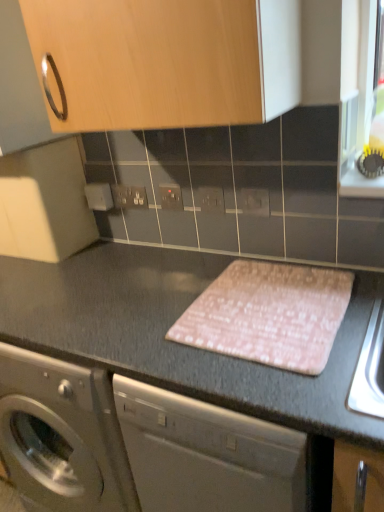
Locate an element on the screen. The height and width of the screenshot is (512, 384). empty space that is ontop of pink fabric at center (from a real-world perspective) is located at coordinates (263, 301).